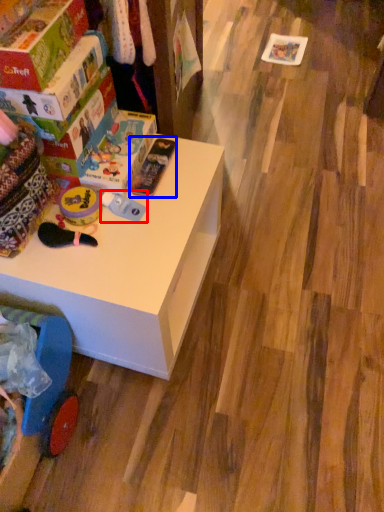
Question: Which object is closer to the camera taking this photo, toy (highlighted by a red box) or toy (highlighted by a blue box)?

Choices:
 (A) toy
 (B) toy

Answer: (A)